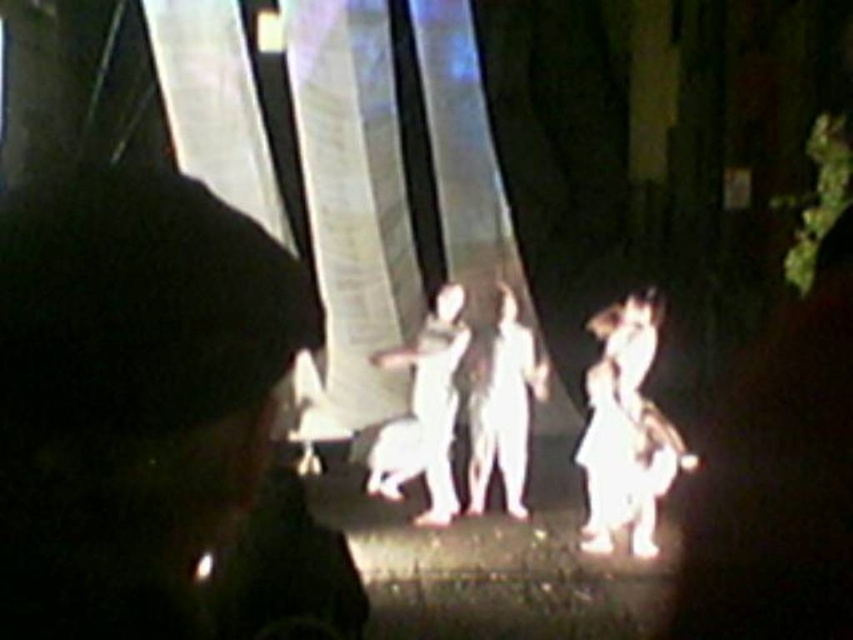
Question: Where is smooth black shirt at center located in relation to white matte figure at center in the image?

Choices:
 (A) below
 (B) above

Answer: (B)

Question: Among these objects, which one is nearest to the camera?

Choices:
 (A) white matte figure at center
 (B) smooth black shirt at center

Answer: (B)

Question: Does smooth black shirt at center appear on the left side of white matte figure at center?

Choices:
 (A) yes
 (B) no

Answer: (A)

Question: Does smooth black shirt at center have a smaller size compared to white matte figure at center?

Choices:
 (A) yes
 (B) no

Answer: (A)